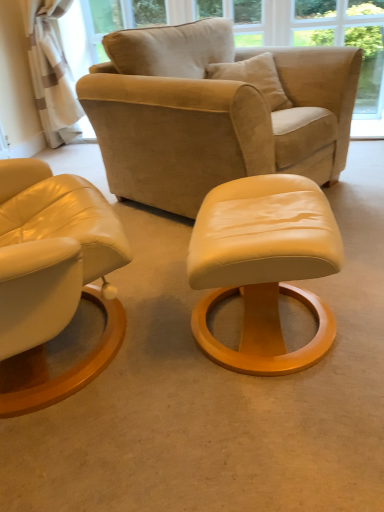
The width and height of the screenshot is (384, 512). What are the coordinates of `matte cream leather ottoman at center` in the screenshot? It's located at (263, 266).

This screenshot has width=384, height=512. Describe the element at coordinates (263, 266) in the screenshot. I see `matte cream leather ottoman at center` at that location.

What do you see at coordinates (213, 113) in the screenshot? I see `suede beige armchair at upper center` at bounding box center [213, 113].

Measure the distance between point (302, 114) and camera.

Point (302, 114) and camera are 2.00 meters apart from each other.

This screenshot has width=384, height=512. I want to click on suede beige armchair at upper center, so click(x=213, y=113).

I want to click on matte cream leather ottoman at center, so click(263, 266).

Is suede beige armchair at upper center to the left or to the right of matte cream leather ottoman at center in the image?

In the image, suede beige armchair at upper center appears on the left side of matte cream leather ottoman at center.

Is suede beige armchair at upper center further to the viewer compared to matte cream leather ottoman at center?

Yes, suede beige armchair at upper center is further from the viewer.

Does point (224, 21) come farther from viewer compared to point (271, 339)?

Yes, it is behind point (271, 339).

From the image's perspective, is suede beige armchair at upper center on top of matte cream leather ottoman at center?

Yes.

From a real-world perspective, between suede beige armchair at upper center and matte cream leather ottoman at center, who is vertically lower?

In real-world perspective, matte cream leather ottoman at center is lower.

Between suede beige armchair at upper center and matte cream leather ottoman at center, which one has larger width?

suede beige armchair at upper center.

Considering the sizes of suede beige armchair at upper center and matte cream leather ottoman at center in the image, is suede beige armchair at upper center taller or shorter than matte cream leather ottoman at center?

Considering their sizes, suede beige armchair at upper center has more height than matte cream leather ottoman at center.

Can you confirm if suede beige armchair at upper center is smaller than matte cream leather ottoman at center?

Incorrect, suede beige armchair at upper center is not smaller in size than matte cream leather ottoman at center.

Which is correct: suede beige armchair at upper center is inside matte cream leather ottoman at center, or outside of it?

suede beige armchair at upper center cannot be found inside matte cream leather ottoman at center.

Are suede beige armchair at upper center and matte cream leather ottoman at center located far from each other?

Actually, suede beige armchair at upper center and matte cream leather ottoman at center are a little close together.

Is suede beige armchair at upper center aimed at matte cream leather ottoman at center?

No, suede beige armchair at upper center does not turn towards matte cream leather ottoman at center.

Find the location of a particular element. chair lying on the left of matte cream leather ottoman at center is located at coordinates point(213,113).

Which object is positioned more to the right, matte cream leather ottoman at center or suede beige armchair at upper center?

matte cream leather ottoman at center is more to the right.

Relative to suede beige armchair at upper center, is matte cream leather ottoman at center in front or behind?

In the image, matte cream leather ottoman at center appears in front of suede beige armchair at upper center.

Between point (328, 345) and point (187, 32), which one is positioned behind?

The point (187, 32) is farther.

From the image's perspective, would you say matte cream leather ottoman at center is positioned over suede beige armchair at upper center?

No, from the image's perspective, matte cream leather ottoman at center is not over suede beige armchair at upper center.

From a real-world perspective, is matte cream leather ottoman at center on suede beige armchair at upper center?

Incorrect, from a real-world perspective, matte cream leather ottoman at center is lower than suede beige armchair at upper center.

Does matte cream leather ottoman at center have a greater width compared to suede beige armchair at upper center?

In fact, matte cream leather ottoman at center might be narrower than suede beige armchair at upper center.

Considering the sizes of objects matte cream leather ottoman at center and suede beige armchair at upper center in the image provided, who is shorter, matte cream leather ottoman at center or suede beige armchair at upper center?

matte cream leather ottoman at center is shorter.

Considering the sizes of objects matte cream leather ottoman at center and suede beige armchair at upper center in the image provided, who is bigger, matte cream leather ottoman at center or suede beige armchair at upper center?

suede beige armchair at upper center.

Do you think matte cream leather ottoman at center is within suede beige armchair at upper center, or outside of it?

matte cream leather ottoman at center is outside suede beige armchair at upper center.

Is matte cream leather ottoman at center placed right next to suede beige armchair at upper center?

No, matte cream leather ottoman at center is not next to suede beige armchair at upper center.

Is matte cream leather ottoman at center oriented away from suede beige armchair at upper center?

That's not correct — matte cream leather ottoman at center is not looking away from suede beige armchair at upper center.

How many degrees apart are the facing directions of matte cream leather ottoman at center and suede beige armchair at upper center?

There is a 36.4-degree angle between the facing directions of matte cream leather ottoman at center and suede beige armchair at upper center.

Identify the location of stool to the right of suede beige armchair at upper center. The height and width of the screenshot is (512, 384). (263, 266).

What are the coordinates of `chair above the matte cream leather ottoman at center (from a real-world perspective)` in the screenshot? It's located at (213, 113).

This screenshot has width=384, height=512. In the image, there is a suede beige armchair at upper center. Find the location of `stool below it (from the image's perspective)`. stool below it (from the image's perspective) is located at coordinates (263, 266).